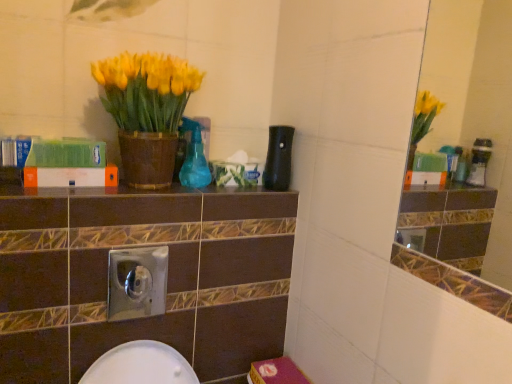
Question: From the image's perspective, is brown glossy ledge at center located beneath white matte book at center, the 1th book positioned from the bottom?

Choices:
 (A) yes
 (B) no

Answer: (A)

Question: Can you confirm if brown glossy ledge at center is wider than white matte book at center, arranged as the second book when viewed from the top?

Choices:
 (A) yes
 (B) no

Answer: (A)

Question: Can white matte book at center, arranged as the second book when viewed from the top, be found inside brown glossy ledge at center?

Choices:
 (A) yes
 (B) no

Answer: (B)

Question: From a real-world perspective, is brown glossy ledge at center on white matte book at center, the 1th book positioned from the bottom?

Choices:
 (A) yes
 (B) no

Answer: (B)

Question: Considering the relative sizes of brown glossy ledge at center and white matte book at center, the 1th book positioned from the bottom, in the image provided, is brown glossy ledge at center shorter than white matte book at center, the 1th book positioned from the bottom,?

Choices:
 (A) yes
 (B) no

Answer: (A)

Question: Looking at the image, does green matte book at upper left, acting as the 1th book starting from the top, seem bigger or smaller compared to white matte book at center, the 1th book positioned from the bottom?

Choices:
 (A) small
 (B) big

Answer: (B)

Question: From a real-world perspective, is green matte book at upper left, acting as the 1th book starting from the top, above or below white matte book at center, the 1th book positioned from the bottom?

Choices:
 (A) above
 (B) below

Answer: (A)

Question: Considering the relative positions of green matte book at upper left, arranged as the 2th book when ordered from the bottom, and white matte book at center, the 1th book positioned from the bottom, in the image provided, is green matte book at upper left, arranged as the 2th book when ordered from the bottom, to the left or to the right of white matte book at center, the 1th book positioned from the bottom,?

Choices:
 (A) left
 (B) right

Answer: (A)

Question: Considering the positions of green matte book at upper left, acting as the 1th book starting from the top, and white matte book at center, the 1th book positioned from the bottom, in the image, is green matte book at upper left, acting as the 1th book starting from the top, taller or shorter than white matte book at center, the 1th book positioned from the bottom,?

Choices:
 (A) tall
 (B) short

Answer: (A)

Question: Is white matte book at center, the 1th book positioned from the bottom, in front of or behind yellow matte vase at upper left in the image?

Choices:
 (A) behind
 (B) front

Answer: (A)

Question: Is point (82, 180) closer or farther from the camera than point (179, 122)?

Choices:
 (A) closer
 (B) farther

Answer: (A)

Question: Is white matte book at center, arranged as the second book when viewed from the top, inside or outside of yellow matte vase at upper left?

Choices:
 (A) inside
 (B) outside

Answer: (B)

Question: From a real-world perspective, is white matte book at center, the 1th book positioned from the bottom, positioned above or below yellow matte vase at upper left?

Choices:
 (A) below
 (B) above

Answer: (A)

Question: Considering the positions of green matte book at upper left, acting as the 1th book starting from the top, and brown glossy ledge at center in the image, is green matte book at upper left, acting as the 1th book starting from the top, wider or thinner than brown glossy ledge at center?

Choices:
 (A) wide
 (B) thin

Answer: (B)

Question: From the image's perspective, is green matte book at upper left, acting as the 1th book starting from the top, above or below brown glossy ledge at center?

Choices:
 (A) above
 (B) below

Answer: (A)